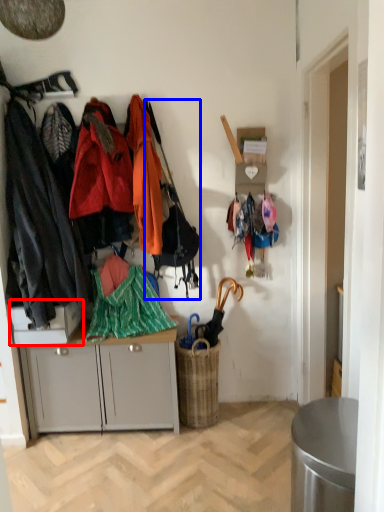
Question: Which object appears closest to the camera in this image, desk (highlighted by a red box) or handbag (highlighted by a blue box)?

Choices:
 (A) desk
 (B) handbag

Answer: (B)